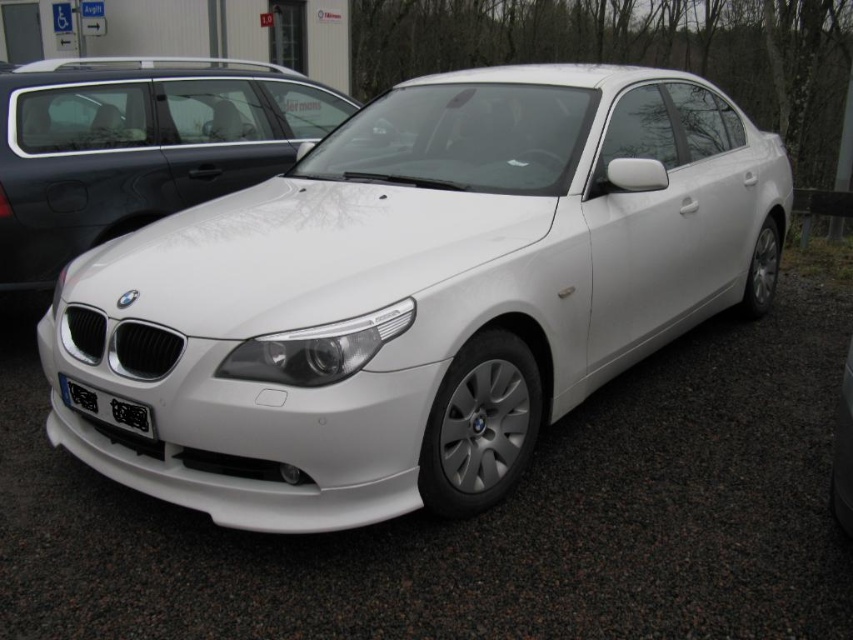
Question: Can you confirm if white glossy car at center is wider than black plastic license plate at front?

Choices:
 (A) no
 (B) yes

Answer: (B)

Question: Among these objects, which one is nearest to the camera?

Choices:
 (A) white metallic car at center
 (B) white glossy sedan at center
 (C) white glossy car at center

Answer: (C)

Question: Which point is closer to the camera?

Choices:
 (A) white glossy car at center
 (B) white metallic car at center
 (C) black plastic license plate at front

Answer: (A)

Question: Does white metallic car at center appear over white glossy car at center?

Choices:
 (A) yes
 (B) no

Answer: (A)

Question: From the image, what is the correct spatial relationship of white glossy sedan at center in relation to black plastic license plate at front?

Choices:
 (A) right
 (B) left

Answer: (B)

Question: Among these objects, which one is nearest to the camera?

Choices:
 (A) white metallic car at center
 (B) white glossy car at center
 (C) white glossy sedan at center

Answer: (B)